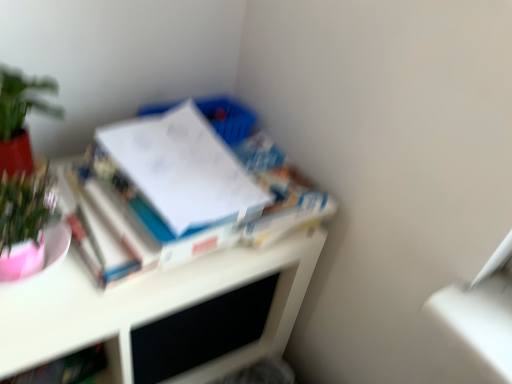
Question: Is point (37, 109) positioned closer to the camera than point (230, 178)?

Choices:
 (A) closer
 (B) farther

Answer: (B)

Question: In terms of height, does green matte plant at upper left look taller or shorter compared to white glossy book at upper left, the first book in the right-to-left sequence?

Choices:
 (A) tall
 (B) short

Answer: (A)

Question: Based on their relative distances, which object is farther from the hardcover book at lower left, which is the first book in bottom-to-top order?

Choices:
 (A) white glossy book at upper left, acting as the 2th book starting from the bottom
 (B) white glossy desk at upper left
 (C) green matte plant at upper left

Answer: (C)

Question: Estimate the real-world distances between objects in this image. Which object is farther from the hardcover book at lower left, arranged as the first book when viewed from the left?

Choices:
 (A) green matte plant at upper left
 (B) white glossy book at upper left, the 1th book positioned from the top
 (C) white glossy desk at upper left

Answer: (A)